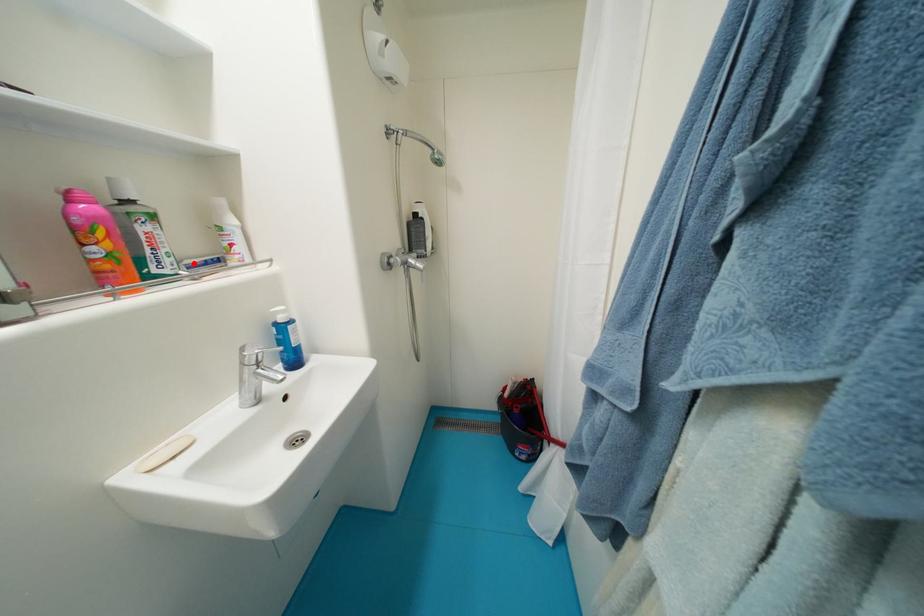
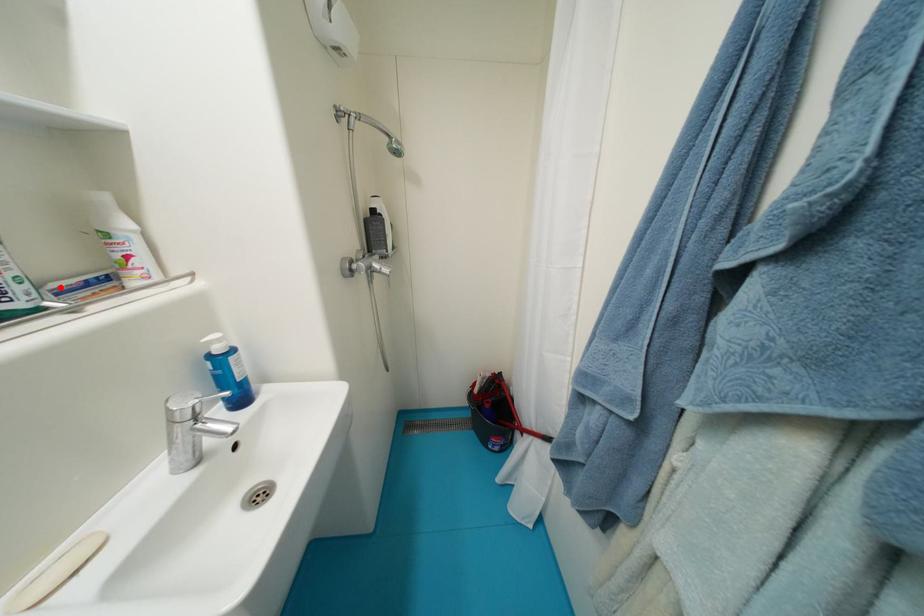
I am providing you with two images of the same scene from different viewpoints. A red point is marked on the first image and another point is marked on the second image. Does the point marked in image1 correspond to the same location as the one in image2?

Yes